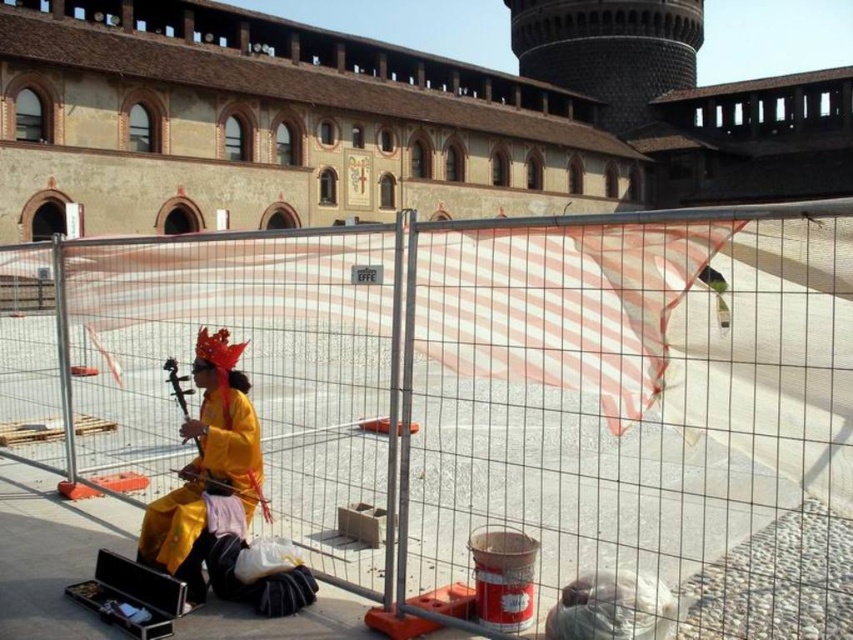
Question: Which point is closer to the camera?

Choices:
 (A) yellow silk robe at center
 (B) metal fence at center

Answer: (B)

Question: Does metal fence at center have a lesser width compared to yellow silk robe at center?

Choices:
 (A) yes
 (B) no

Answer: (B)

Question: Is metal fence at center below yellow silk robe at center?

Choices:
 (A) no
 (B) yes

Answer: (A)

Question: Is metal fence at center behind yellow silk robe at center?

Choices:
 (A) yes
 (B) no

Answer: (B)

Question: Which point appears closest to the camera in this image?

Choices:
 (A) (229, 346)
 (B) (459, 268)

Answer: (B)